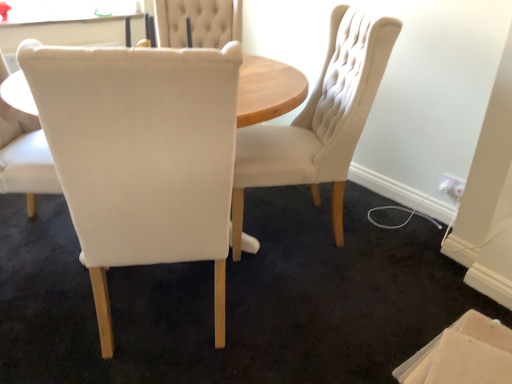
Question: From a real-world perspective, is matte white chair at center, the second chair when ordered from right to left, physically below beige cardboard box at lower right?

Choices:
 (A) yes
 (B) no

Answer: (B)

Question: From the image's perspective, is matte white chair at center, acting as the second chair starting from the left, located beneath beige cardboard box at lower right?

Choices:
 (A) yes
 (B) no

Answer: (B)

Question: From the image's perspective, is matte white chair at center, the second chair when ordered from right to left, on beige cardboard box at lower right?

Choices:
 (A) yes
 (B) no

Answer: (A)

Question: From a real-world perspective, is matte white chair at center, acting as the second chair starting from the left, positioned over beige cardboard box at lower right based on gravity?

Choices:
 (A) yes
 (B) no

Answer: (A)

Question: Can you confirm if matte white chair at center, the second chair when ordered from right to left, is positioned to the right of beige cardboard box at lower right?

Choices:
 (A) no
 (B) yes

Answer: (A)

Question: From a real-world perspective, is beige cardboard box at lower right above or below matte white chair at center, the second chair when ordered from right to left?

Choices:
 (A) below
 (B) above

Answer: (A)

Question: Is beige cardboard box at lower right taller or shorter than matte white chair at center, the second chair when ordered from right to left?

Choices:
 (A) short
 (B) tall

Answer: (A)

Question: Does point (434, 347) appear closer or farther from the camera than point (104, 309)?

Choices:
 (A) closer
 (B) farther

Answer: (B)

Question: Is beige cardboard box at lower right to the left or to the right of matte white chair at center, the second chair when ordered from right to left, in the image?

Choices:
 (A) right
 (B) left

Answer: (A)

Question: Is point (9, 175) closer or farther from the camera than point (471, 322)?

Choices:
 (A) farther
 (B) closer

Answer: (A)

Question: From the image's perspective, is white fabric chair at center, the first chair when ordered from left to right, positioned above or below beige cardboard box at lower right?

Choices:
 (A) above
 (B) below

Answer: (A)

Question: Is white fabric chair at center, which appears as the 3th chair when viewed from the right, situated inside beige cardboard box at lower right or outside?

Choices:
 (A) outside
 (B) inside

Answer: (A)

Question: In terms of width, does white fabric chair at center, the first chair when ordered from left to right, look wider or thinner when compared to beige cardboard box at lower right?

Choices:
 (A) wide
 (B) thin

Answer: (A)

Question: Considering the positions of matte white chair at center, the second chair when ordered from right to left, and white fabric chair at center, the first chair when ordered from left to right, in the image, is matte white chair at center, the second chair when ordered from right to left, wider or thinner than white fabric chair at center, the first chair when ordered from left to right,?

Choices:
 (A) thin
 (B) wide

Answer: (B)

Question: In terms of height, does matte white chair at center, acting as the second chair starting from the left, look taller or shorter compared to white fabric chair at center, which appears as the 3th chair when viewed from the right?

Choices:
 (A) tall
 (B) short

Answer: (A)